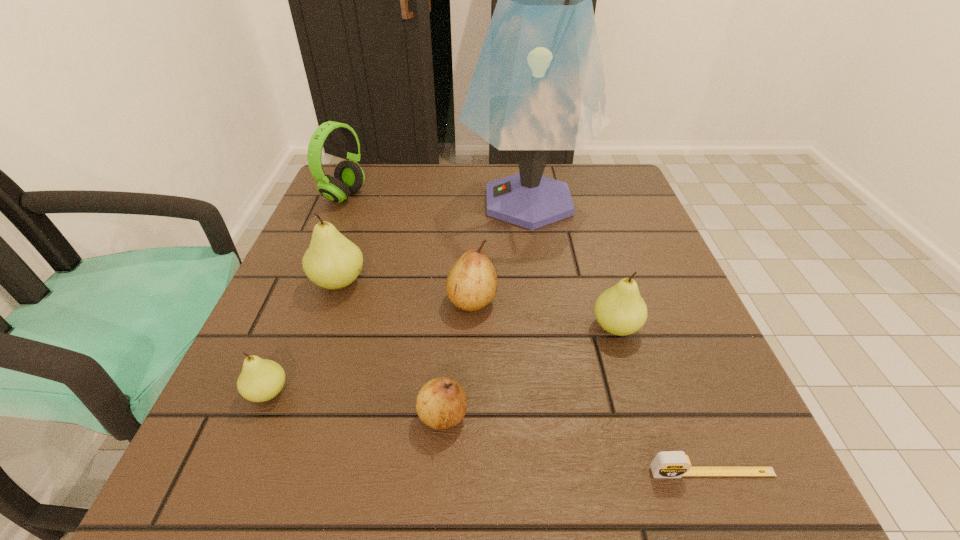
Find the location of a particular element. Image resolution: width=960 pixels, height=540 pixels. tape measure is located at coordinates (667, 464).

You are a GUI agent. You are given a task and a screenshot of the screen. Output one action in this format:
    pyautogui.click(x=<x>, y=<y>)
    Task: Click on the shortest object
    The image size is (960, 540).
    Given the screenshot: What is the action you would take?
    pyautogui.click(x=667, y=464)

Find the location of `vacant space located on the base of the tallest object`. vacant space located on the base of the tallest object is located at coordinates (413, 202).

Where is `free location located on the base of the tallest object`? free location located on the base of the tallest object is located at coordinates (425, 202).

Locate an element on the screen. vacant position located on the base of the tallest object is located at coordinates (345, 202).

The image size is (960, 540). Identify the location of free space located on the front of the headset. (312, 272).

At what (x,y) coordinates should I click in order to perform the action: click on vacant space located on the right of the tallest pear. Please return your answer as a coordinate pair (x, y). The height and width of the screenshot is (540, 960). Looking at the image, I should click on (557, 282).

Locate an element on the screen. The image size is (960, 540). vacant space located 0.280m on the back of the rightmost green pear is located at coordinates (584, 223).

Where is `free point located on the right of the bigger brown pear`? This screenshot has width=960, height=540. free point located on the right of the bigger brown pear is located at coordinates (691, 300).

Identify the location of free space located on the back of the smallest green pear. (312, 286).